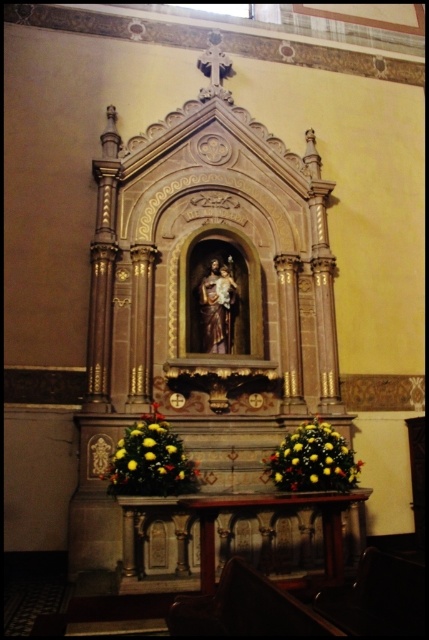
Which of these two, yellow floral arrangement at center or yellow floral arrangement at lower center, stands shorter?

yellow floral arrangement at lower center is shorter.

Which is below, yellow floral arrangement at center or yellow floral arrangement at lower center?

yellow floral arrangement at lower center is below.

Is point (138, 488) farther from camera compared to point (326, 424)?

No, (138, 488) is in front of (326, 424).

Identify the location of yellow floral arrangement at center. (150, 460).